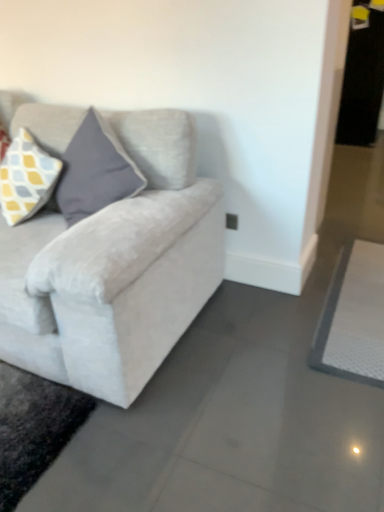
Question: Which direction should I rotate to look at yellow and gray checkered fabric pillow at upper left?

Choices:
 (A) left
 (B) right

Answer: (A)

Question: Is velvet light gray couch at left closer to camera compared to yellow and gray checkered fabric pillow at upper left?

Choices:
 (A) yes
 (B) no

Answer: (A)

Question: Is velvet light gray couch at left not close to yellow and gray checkered fabric pillow at upper left?

Choices:
 (A) yes
 (B) no

Answer: (B)

Question: Can you confirm if velvet light gray couch at left is bigger than yellow and gray checkered fabric pillow at upper left?

Choices:
 (A) no
 (B) yes

Answer: (B)

Question: Is velvet light gray couch at left taller than yellow and gray checkered fabric pillow at upper left?

Choices:
 (A) no
 (B) yes

Answer: (B)

Question: Is velvet light gray couch at left shorter than yellow and gray checkered fabric pillow at upper left?

Choices:
 (A) no
 (B) yes

Answer: (A)

Question: Considering the relative positions of velvet light gray couch at left and yellow and gray checkered fabric pillow at upper left in the image provided, is velvet light gray couch at left to the right of yellow and gray checkered fabric pillow at upper left from the viewer's perspective?

Choices:
 (A) no
 (B) yes

Answer: (A)

Question: Does white textured yoga mat at lower right have a smaller size compared to yellow and gray checkered fabric pillow at upper left?

Choices:
 (A) no
 (B) yes

Answer: (B)

Question: Is white textured yoga mat at lower right in contact with yellow and gray checkered fabric pillow at upper left?

Choices:
 (A) yes
 (B) no

Answer: (B)

Question: Is yellow and gray checkered fabric pillow at upper left surrounded by white textured yoga mat at lower right?

Choices:
 (A) no
 (B) yes

Answer: (A)

Question: Can you confirm if white textured yoga mat at lower right is wider than yellow and gray checkered fabric pillow at upper left?

Choices:
 (A) yes
 (B) no

Answer: (A)

Question: From a real-world perspective, is white textured yoga mat at lower right beneath yellow and gray checkered fabric pillow at upper left?

Choices:
 (A) no
 (B) yes

Answer: (B)

Question: Is white textured yoga mat at lower right facing towards yellow and gray checkered fabric pillow at upper left?

Choices:
 (A) no
 (B) yes

Answer: (A)

Question: Does velvet light gray couch at left have a larger size compared to white textured yoga mat at lower right?

Choices:
 (A) no
 (B) yes

Answer: (B)